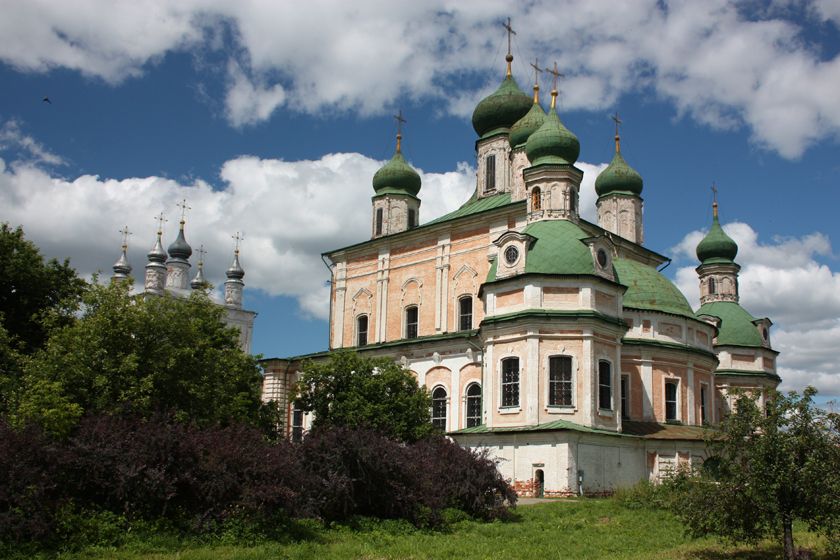
This screenshot has width=840, height=560. In order to click on archway in this screenshot , I will do `click(709, 451)`.